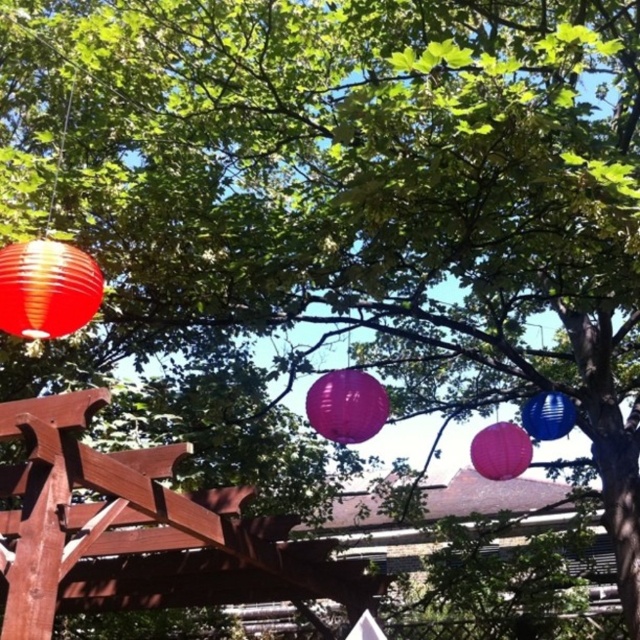
Between matte red paper lantern at left and purple paper lantern at center, which one has more height?

matte red paper lantern at left is taller.

Does matte red paper lantern at left appear under purple paper lantern at center?

Actually, matte red paper lantern at left is above purple paper lantern at center.

Which is behind, point (6, 248) or point (512, 468)?

Point (512, 468)

The image size is (640, 640). I want to click on matte red paper lantern at left, so click(x=45, y=289).

Does purple glossy lantern at center have a lesser width compared to blue glossy lantern at right?

Incorrect, purple glossy lantern at center's width is not less than blue glossy lantern at right's.

Is purple glossy lantern at center smaller than blue glossy lantern at right?

No, purple glossy lantern at center is not smaller than blue glossy lantern at right.

Measure the distance between purple glossy lantern at center and camera.

purple glossy lantern at center is 4.89 meters from camera.

Find the location of a particular element. Image resolution: width=640 pixels, height=640 pixels. purple glossy lantern at center is located at coordinates coord(346,404).

Is point (12, 301) farther from viewer compared to point (561, 401)?

No, it is not.

Can you confirm if matte red paper lantern at left is smaller than blue glossy lantern at right?

Actually, matte red paper lantern at left might be larger than blue glossy lantern at right.

The width and height of the screenshot is (640, 640). What are the coordinates of `matte red paper lantern at left` in the screenshot? It's located at (45, 289).

Identify the location of matte red paper lantern at left. (45, 289).